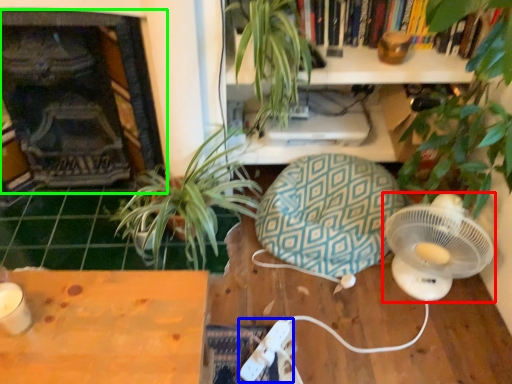
Question: Which is nearer to the mechanical fan (highlighted by a red box)? Wii controller (highlighted by a blue box) or fireplace (highlighted by a green box).

Choices:
 (A) Wii controller
 (B) fireplace

Answer: (A)